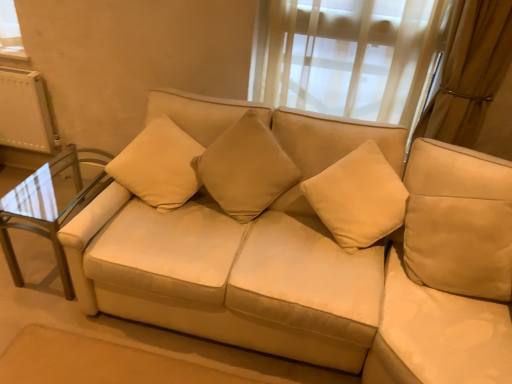
Question: Should I look upward or downward to see beige fabric pillow at upper left, which is counted as the 2th pillow, starting from the right?

Choices:
 (A) down
 (B) up

Answer: (B)

Question: Does suede-like beige pillow at center, which is the first pillow in right-to-left order, have a lesser height compared to beige fabric couch at center?

Choices:
 (A) yes
 (B) no

Answer: (A)

Question: Considering the relative sizes of suede-like beige pillow at center, which is the first pillow in right-to-left order, and beige fabric couch at center in the image provided, is suede-like beige pillow at center, which is the first pillow in right-to-left order, taller than beige fabric couch at center?

Choices:
 (A) no
 (B) yes

Answer: (A)

Question: From a real-world perspective, is suede-like beige pillow at center, which is the first pillow in right-to-left order, positioned over beige fabric couch at center based on gravity?

Choices:
 (A) yes
 (B) no

Answer: (A)

Question: Is suede-like beige pillow at center, which is the first pillow in right-to-left order, to the left of beige fabric couch at center from the viewer's perspective?

Choices:
 (A) no
 (B) yes

Answer: (A)

Question: Considering the relative sizes of suede-like beige pillow at center, which is the 2th pillow from left to right, and beige fabric couch at center in the image provided, is suede-like beige pillow at center, which is the 2th pillow from left to right, smaller than beige fabric couch at center?

Choices:
 (A) yes
 (B) no

Answer: (A)

Question: Does suede-like beige pillow at center, which is the 2th pillow from left to right, come behind beige fabric couch at center?

Choices:
 (A) yes
 (B) no

Answer: (A)

Question: From a real-world perspective, is beige fabric pillow at upper left, which is counted as the 2th pillow, starting from the right, located higher than beige fabric couch at center?

Choices:
 (A) yes
 (B) no

Answer: (A)

Question: Is beige fabric pillow at upper left, which is counted as the 2th pillow, starting from the right, further to camera compared to beige fabric couch at center?

Choices:
 (A) no
 (B) yes

Answer: (B)

Question: Could beige fabric couch at center be considered to be inside beige fabric pillow at upper left, which is counted as the 2th pillow, starting from the right?

Choices:
 (A) no
 (B) yes

Answer: (A)

Question: Considering the relative sizes of beige fabric pillow at upper left, which is counted as the 2th pillow, starting from the right, and beige fabric couch at center in the image provided, is beige fabric pillow at upper left, which is counted as the 2th pillow, starting from the right, wider than beige fabric couch at center?

Choices:
 (A) yes
 (B) no

Answer: (B)

Question: Is beige fabric pillow at upper left, arranged as the first pillow when viewed from the left, closer to camera compared to beige fabric couch at center?

Choices:
 (A) yes
 (B) no

Answer: (B)

Question: From the image's perspective, is beige fabric pillow at upper left, which is counted as the 2th pillow, starting from the right, located above beige fabric couch at center?

Choices:
 (A) no
 (B) yes

Answer: (B)

Question: Does beige fabric pillow at upper left, arranged as the first pillow when viewed from the left, have a smaller size compared to clear glass table at left?

Choices:
 (A) yes
 (B) no

Answer: (A)